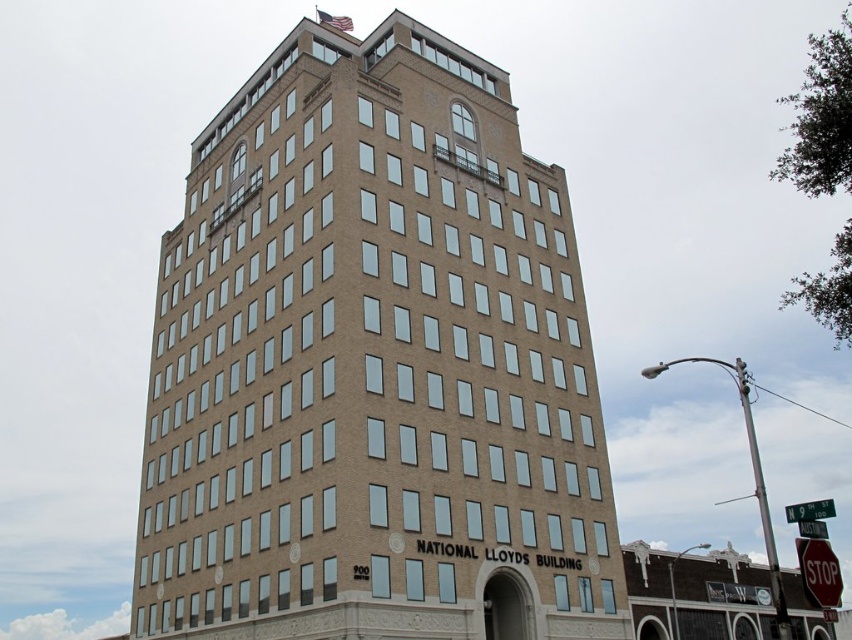
Question: Which of the following is the farthest from the observer?

Choices:
 (A) red brick hotel at lower right
 (B) brown brick building at center

Answer: (A)

Question: Is brown brick building at center positioned behind red brick hotel at lower right?

Choices:
 (A) yes
 (B) no

Answer: (B)

Question: Is brown brick building at center bigger than red brick hotel at lower right?

Choices:
 (A) yes
 (B) no

Answer: (B)

Question: Can you confirm if brown brick building at center is wider than red brick hotel at lower right?

Choices:
 (A) yes
 (B) no

Answer: (B)

Question: Among these objects, which one is farthest from the camera?

Choices:
 (A) red brick hotel at lower right
 (B) brown brick building at center

Answer: (A)

Question: Which point is farther from the camera taking this photo?

Choices:
 (A) (795, 605)
 (B) (298, 428)

Answer: (A)